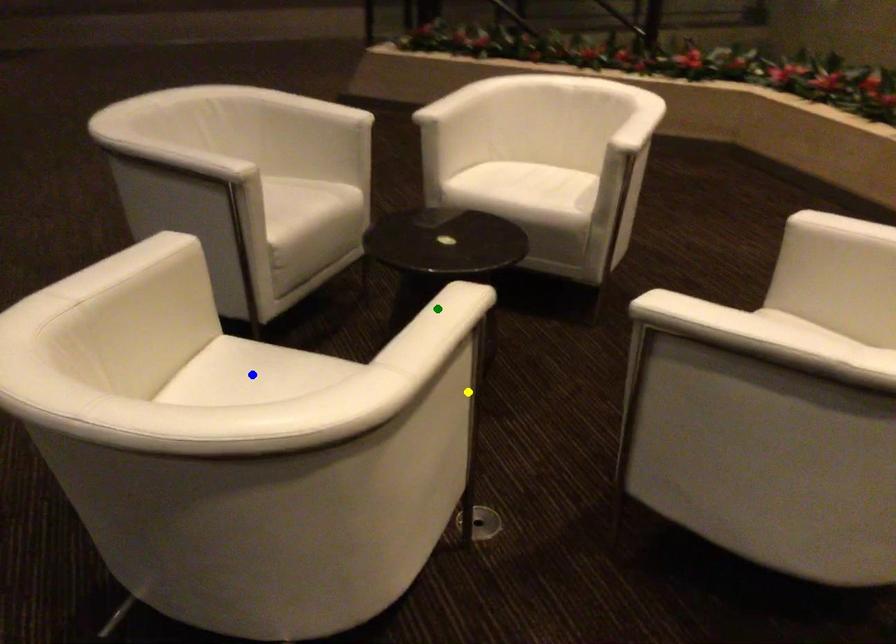
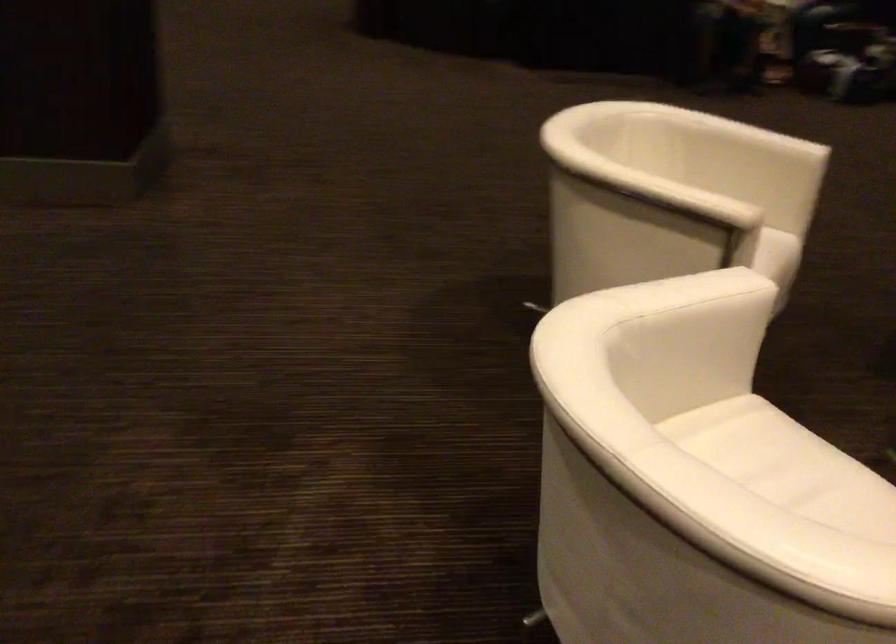
I am providing you with two images of the same scene from different viewpoints. Three points are marked in image1. Which point corresponds to a part or object that is occluded in image2?In image1, three points are marked. Which of them correspond to a part or object that is occluded in image2?Among the three points shown in image1, which one corresponds to a part or object that is no longer visible due to occlusion in image2?

green point, blue point